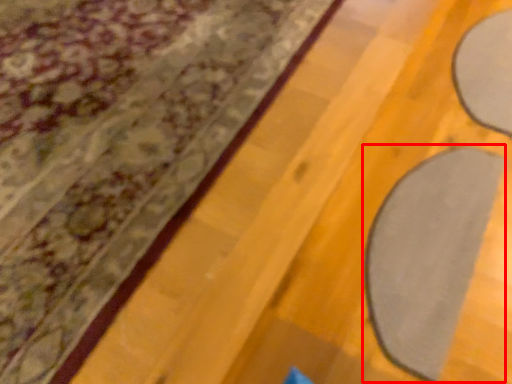
Question: Where is yoga mat (annotated by the red box) located in relation to curtain in the image?

Choices:
 (A) right
 (B) left

Answer: (A)